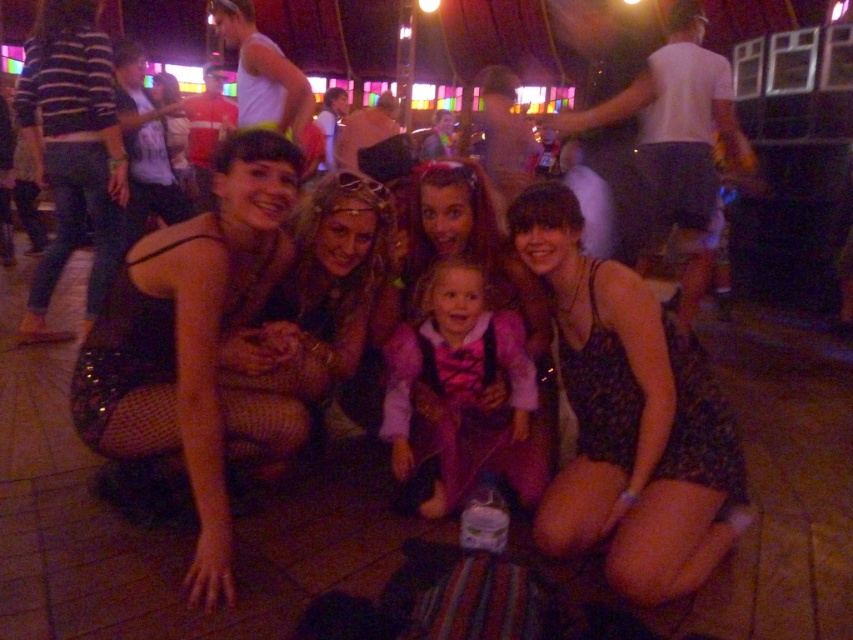
Between black floral dress at center and purple velvet dress at center, which one has more height?

Standing taller between the two is black floral dress at center.

Does black floral dress at center have a smaller size compared to purple velvet dress at center?

Incorrect, black floral dress at center is not smaller in size than purple velvet dress at center.

Image resolution: width=853 pixels, height=640 pixels. What are the coordinates of `black floral dress at center` in the screenshot? It's located at (630, 419).

You are a GUI agent. You are given a task and a screenshot of the screen. Output one action in this format:
    pyautogui.click(x=<x>, y=<y>)
    Task: Click on the black floral dress at center
    Image resolution: width=853 pixels, height=640 pixels.
    Given the screenshot: What is the action you would take?
    pyautogui.click(x=630, y=419)

Looking at this image, is matte black dress at center thinner than purple velvet dress at center?

No, matte black dress at center is not thinner than purple velvet dress at center.

Is point (223, 500) less distant than point (424, 284)?

Yes, point (223, 500) is closer to viewer.

Is point (103, 432) behind point (537, 486)?

No, it is in front of (537, 486).

The image size is (853, 640). I want to click on matte black dress at center, so click(196, 346).

Is black floral dress at center thinner than matte black dress at center?

No, black floral dress at center is not thinner than matte black dress at center.

Between black floral dress at center and matte black dress at center, which one appears on the left side from the viewer's perspective?

Positioned to the left is matte black dress at center.

Is point (587, 358) in front of point (154, 304)?

No, it is not.

Locate an element on the screen. Image resolution: width=853 pixels, height=640 pixels. black floral dress at center is located at coordinates (630, 419).